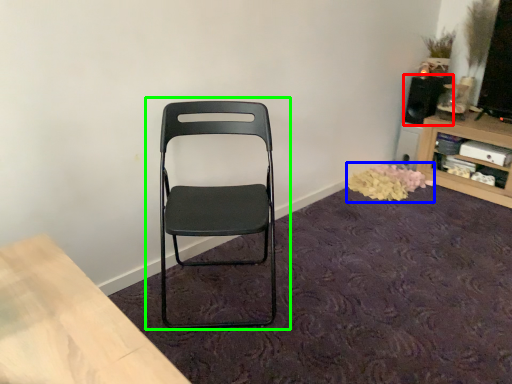
Question: Which object is positioned farthest from speaker (highlighted by a red box)? Select from flower (highlighted by a blue box) and chair (highlighted by a green box).

Choices:
 (A) flower
 (B) chair

Answer: (B)